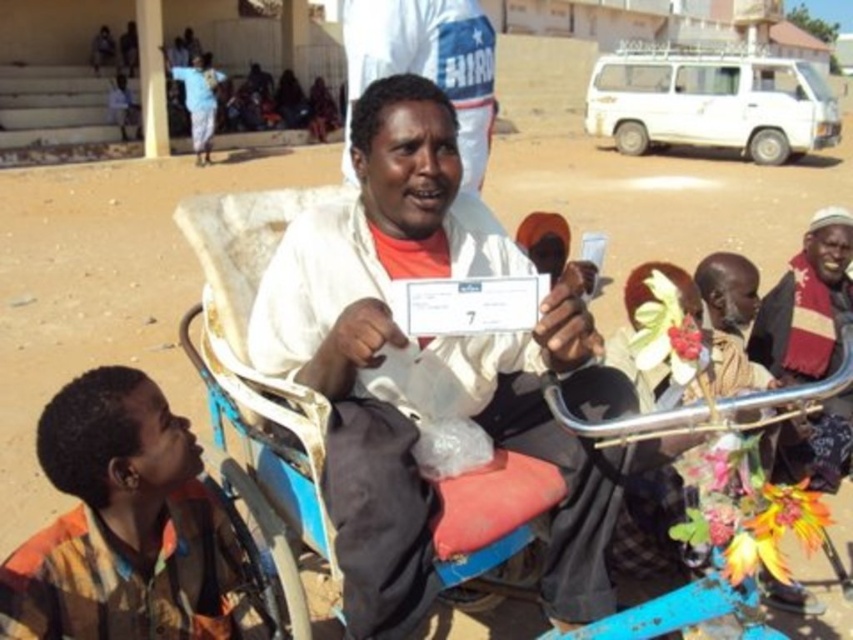
Question: Does multicolored fabric shirt at lower left have a greater width compared to blue metallic cart at center?

Choices:
 (A) no
 (B) yes

Answer: (A)

Question: From the image, what is the correct spatial relationship of white matte shirt at center in relation to multicolored fabric shirt at lower left?

Choices:
 (A) below
 (B) above

Answer: (B)

Question: Can you confirm if white matte shirt at center is wider than multicolored fabric shirt at lower left?

Choices:
 (A) no
 (B) yes

Answer: (B)

Question: Which point is closer to the camera taking this photo?

Choices:
 (A) (582, 586)
 (B) (466, 548)

Answer: (B)

Question: Which of the following is the closest to the observer?

Choices:
 (A) (492, 241)
 (B) (184, 609)

Answer: (B)

Question: Which point is farther to the camera?

Choices:
 (A) blue metallic cart at center
 (B) multicolored fabric shirt at lower left

Answer: (A)